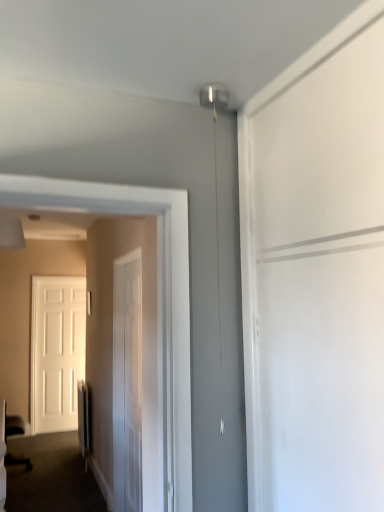
Locate an element on the screen. Image resolution: width=384 pixels, height=512 pixels. matte black bed at lower left is located at coordinates (13, 425).

Image resolution: width=384 pixels, height=512 pixels. What do you see at coordinates (13, 425) in the screenshot?
I see `matte black bed at lower left` at bounding box center [13, 425].

Where is `matte black bed at lower left`? This screenshot has height=512, width=384. matte black bed at lower left is located at coordinates (13, 425).